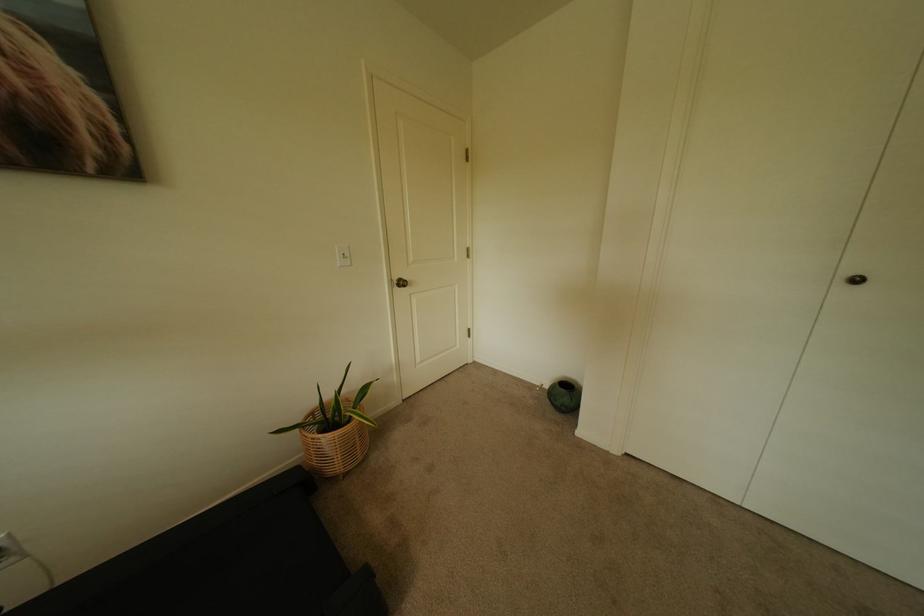
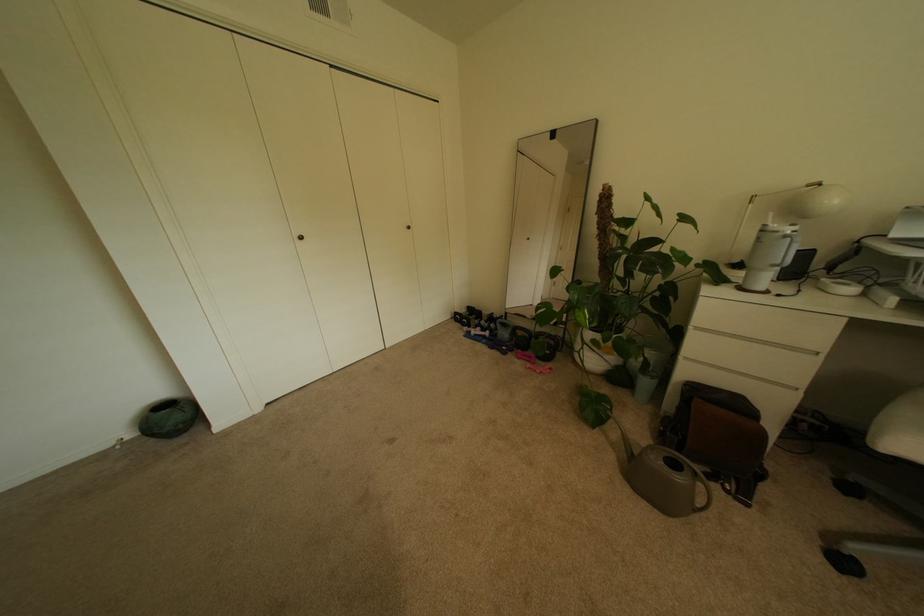
First-person continuous shooting, in which direction is the camera rotating?

The rotation direction of the camera is right-down.